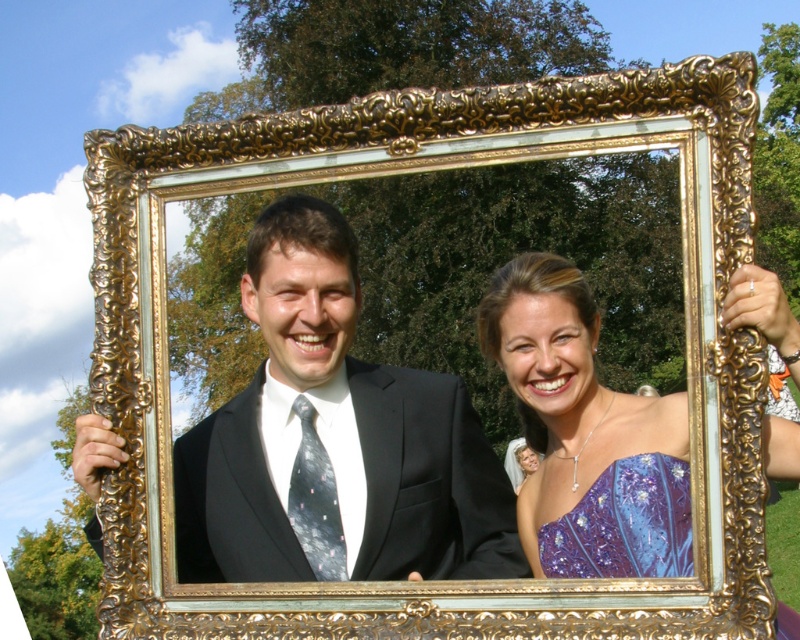
You are taking a photo of two people standing in front of you. You notice two specific points on their clothing, one at point (462, 496) and the other at point (630, 460). Which point is closer to your camera?

Point (462, 496) is further to the camera than point (630, 460). Therefore, point (630, 460) is closer to the camera.

Based on the coordinates provided, which object in the scene corresponds to the point at location [586,435]?

The shiny blue dress at center corresponds to the point at location [586,435].

You are a photographer adjusting the camera focus. The black satin suit at center and the shiny blue dress at center are both in the frame. Which one do you need to adjust the focus for if the camera is currently focused on the taller object?

The camera is focused on the black satin suit at center, which is taller than the shiny blue dress at center. Therefore, no adjustment is needed for the black satin suit at center, but you may need to adjust focus for the shiny blue dress at center if it is out of focus.